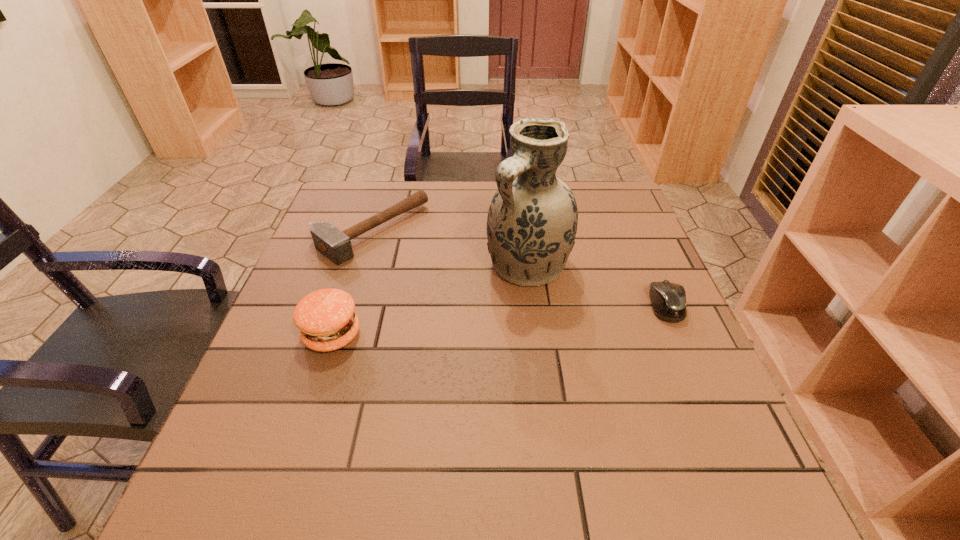
This screenshot has height=540, width=960. I want to click on blank area located on the striking surface of the hammer, so click(x=510, y=324).

Find the location of a particular element. This screenshot has height=540, width=960. vacant space located on the striking surface of the hammer is located at coordinates [x=429, y=270].

Image resolution: width=960 pixels, height=540 pixels. In order to click on free space located 0.270m on the striking surface of the hammer in this screenshot , I will do `click(483, 306)`.

Where is `object at the far edge`? The height and width of the screenshot is (540, 960). object at the far edge is located at coordinates (336, 245).

This screenshot has height=540, width=960. Identify the location of patty present at the left edge. (326, 319).

Where is `hammer at the left edge`? hammer at the left edge is located at coordinates (336, 245).

This screenshot has height=540, width=960. I want to click on object present at the right edge, so click(668, 299).

I want to click on object at the far left corner, so click(x=336, y=245).

Locate an element on the screen. vacant area at the far edge is located at coordinates (411, 184).

In the image, there is a desktop. At what (x,y) coordinates should I click in order to perform the action: click on free space at the near edge. Please return your answer as a coordinate pair (x, y). Looking at the image, I should click on (351, 437).